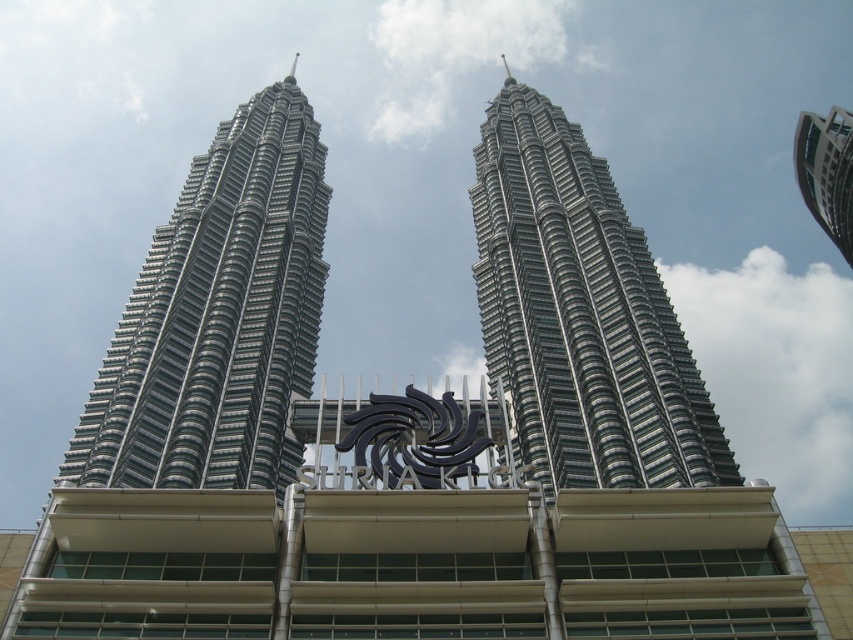
Question: Can you confirm if black metal logo at center is smaller than silver metallic building at upper right?

Choices:
 (A) no
 (B) yes

Answer: (B)

Question: Which of the following is the farthest from the observer?

Choices:
 (A) (842, 115)
 (B) (402, 417)
 (C) (589, 468)
 (D) (181, 444)

Answer: (A)

Question: Among these objects, which one is nearest to the camera?

Choices:
 (A) silver metallic building at upper right
 (B) silver metallic building at center

Answer: (B)

Question: Estimate the real-world distances between objects in this image. Which object is closer to the silver metallic building at center?

Choices:
 (A) silver metallic twin towers at center
 (B) silver metallic building at upper right
 (C) black metal logo at center

Answer: (A)

Question: Can you confirm if silver metallic building at center is positioned above silver metallic building at upper right?

Choices:
 (A) no
 (B) yes

Answer: (A)

Question: Can you confirm if silver metallic building at center is thinner than silver metallic building at upper right?

Choices:
 (A) yes
 (B) no

Answer: (A)